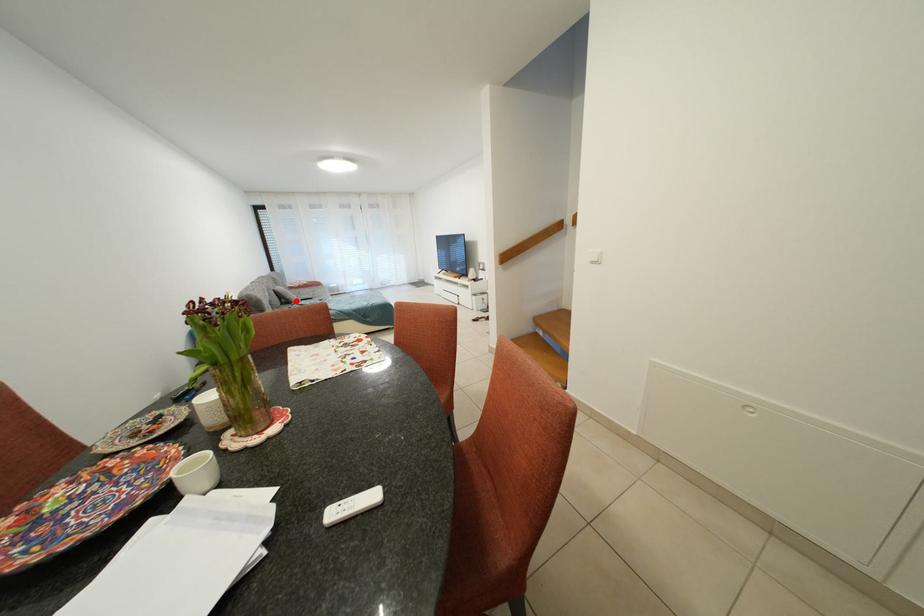
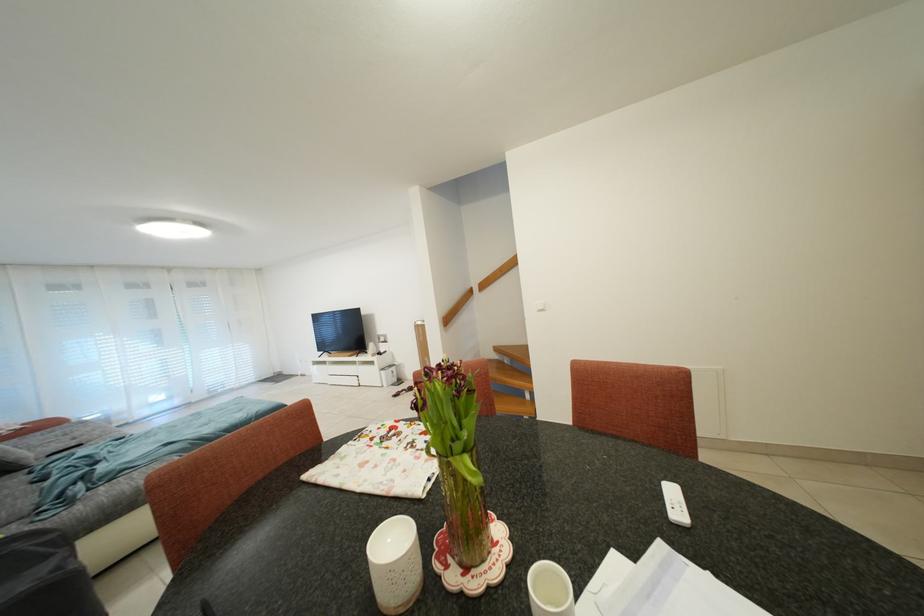
Question: A red point is marked in image1. In image2, is the corresponding 3D point closer to the camera or farther? Reply with the corresponding letter.

Choices:
 (A) The corresponding 3D point is closer.
 (B) The corresponding 3D point is farther.

Answer: (B)